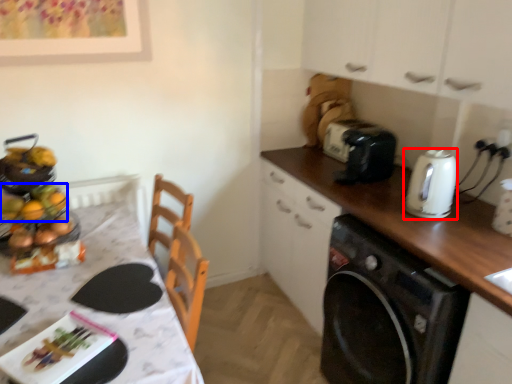
Question: Which object appears closest to the camera in this image, kitchen appliance (highlighted by a red box) or food (highlighted by a blue box)?

Choices:
 (A) kitchen appliance
 (B) food

Answer: (B)